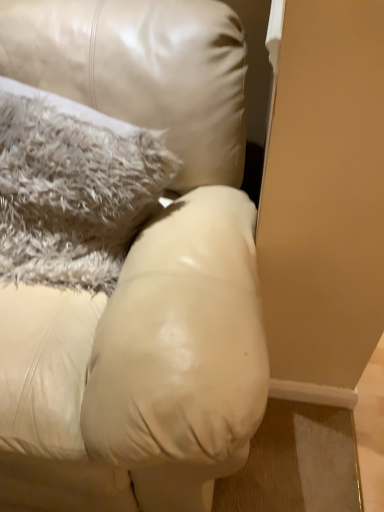
Question: From a real-world perspective, is fuzzy gray pillow at upper left above or below matte leather couch at center?

Choices:
 (A) below
 (B) above

Answer: (B)

Question: In the image, is fuzzy gray pillow at upper left on the left side or the right side of matte leather couch at center?

Choices:
 (A) right
 (B) left

Answer: (A)

Question: Is fuzzy gray pillow at upper left spatially inside matte leather couch at center, or outside of it?

Choices:
 (A) outside
 (B) inside

Answer: (B)

Question: From the image's perspective, is matte leather couch at center above or below fuzzy gray pillow at upper left?

Choices:
 (A) below
 (B) above

Answer: (A)

Question: Considering the positions of matte leather couch at center and fuzzy gray pillow at upper left in the image, is matte leather couch at center wider or thinner than fuzzy gray pillow at upper left?

Choices:
 (A) wide
 (B) thin

Answer: (A)

Question: Relative to fuzzy gray pillow at upper left, is matte leather couch at center in front or behind?

Choices:
 (A) behind
 (B) front

Answer: (B)

Question: In the image, is matte leather couch at center on the left side or the right side of fuzzy gray pillow at upper left?

Choices:
 (A) left
 (B) right

Answer: (A)